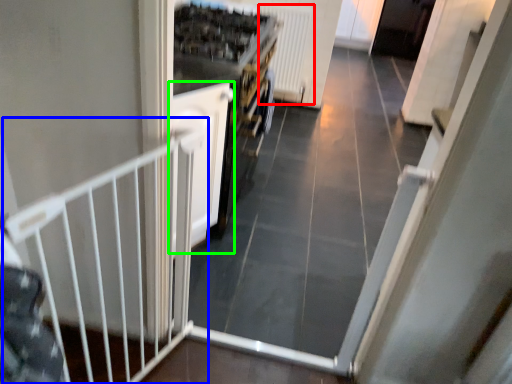
Question: Considering the real-world distances, which object is farthest from radiator (highlighted by a red box)? rail (highlighted by a blue box) or door (highlighted by a green box)?

Choices:
 (A) rail
 (B) door

Answer: (A)